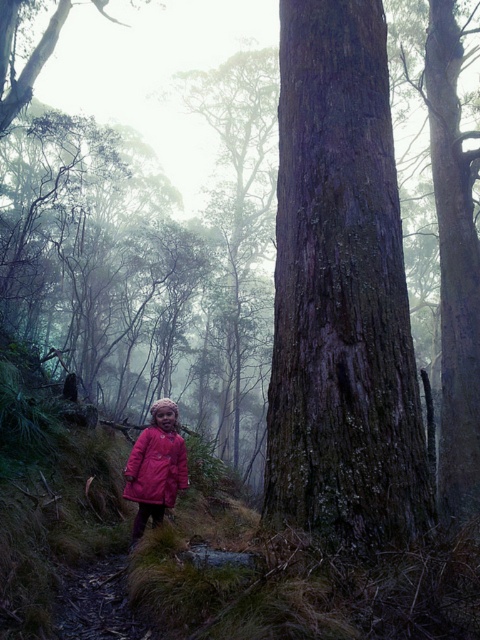
Question: Is smooth brown bark at center above matte pink coat at center?

Choices:
 (A) no
 (B) yes

Answer: (B)

Question: Can you confirm if smooth brown bark at center is positioned above matte pink coat at center?

Choices:
 (A) yes
 (B) no

Answer: (A)

Question: Is smooth brown bark at center below matte pink coat at center?

Choices:
 (A) no
 (B) yes

Answer: (A)

Question: Which point is farther to the camera?

Choices:
 (A) (291, 353)
 (B) (173, 403)

Answer: (B)

Question: Which of the following is the farthest from the observer?

Choices:
 (A) matte pink coat at center
 (B) smooth brown bark at center

Answer: (A)